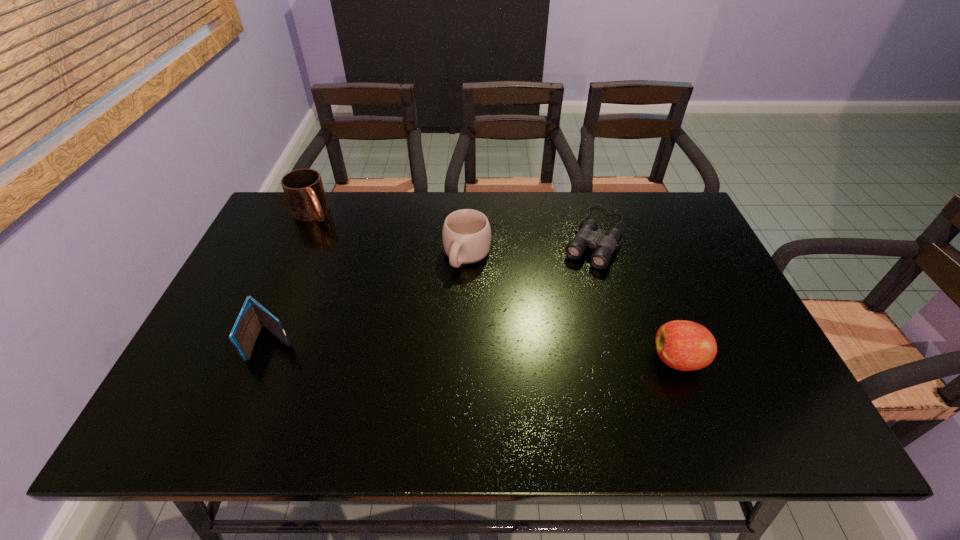
The image size is (960, 540). In order to click on mug located in the left edge section of the desktop in this screenshot , I will do `click(303, 188)`.

Where is `object at the right edge`? object at the right edge is located at coordinates (683, 345).

Where is `object that is at the far left corner`? This screenshot has height=540, width=960. object that is at the far left corner is located at coordinates (303, 188).

This screenshot has height=540, width=960. Find the location of `object that is at the near right corner`. object that is at the near right corner is located at coordinates (683, 345).

Find the location of a particular element. The image size is (960, 540). free space at the far edge of the desktop is located at coordinates (555, 205).

Identify the location of free space at the near edge of the desktop. (531, 385).

You are a GUI agent. You are given a task and a screenshot of the screen. Output one action in this format:
    pyautogui.click(x=<x>, y=<y>)
    Task: Click on the vacant region at the left edge of the desktop
    Image resolution: width=960 pixels, height=540 pixels.
    Given the screenshot: What is the action you would take?
    pyautogui.click(x=286, y=262)

This screenshot has height=540, width=960. In the image, there is a desktop. What are the coordinates of `vacant region at the near left corner` in the screenshot? It's located at (204, 396).

You are a GUI agent. You are given a task and a screenshot of the screen. Output one action in this format:
    pyautogui.click(x=<x>, y=<y>)
    Task: Click on the free space at the far right corner
    The image size is (960, 540).
    Given the screenshot: What is the action you would take?
    pyautogui.click(x=659, y=192)

Find the location of `free space between the farther mug and the wallet`. free space between the farther mug and the wallet is located at coordinates (293, 278).